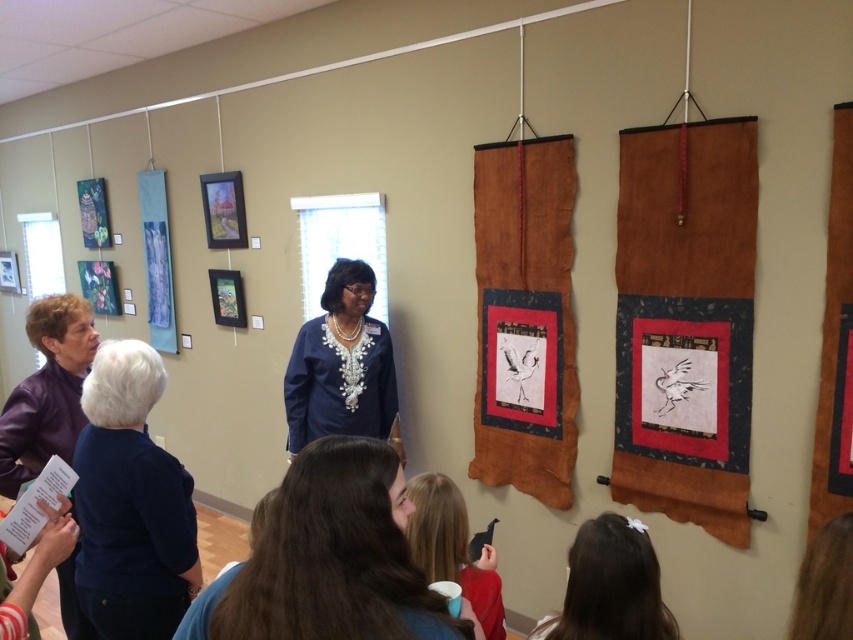
Question: Is matte brown scroll at right further to the viewer compared to dark blue sweater at lower left?

Choices:
 (A) yes
 (B) no

Answer: (A)

Question: Does brown hair at lower center have a larger size compared to matte red shirt at lower center?

Choices:
 (A) no
 (B) yes

Answer: (A)

Question: In this image, where is rustic brown fabric at center located relative to dark blue sweater at lower left?

Choices:
 (A) right
 (B) left

Answer: (A)

Question: Which of these objects is positioned farthest from the purple leather jacket at lower left?

Choices:
 (A) dark blue sweater at lower left
 (B) blue embroidered blouse at center
 (C) rustic brown fabric at center
 (D) matte brown scroll at right

Answer: (D)

Question: Which is nearer to the rustic brown fabric at center?

Choices:
 (A) purple leather jacket at lower left
 (B) brown leather hairband at lower center
 (C) blue embroidered blouse at center
 (D) matte red shirt at lower center

Answer: (C)

Question: Which point is farther from the camera taking this photo?

Choices:
 (A) (666, 433)
 (B) (341, 282)
 (C) (158, 468)

Answer: (B)